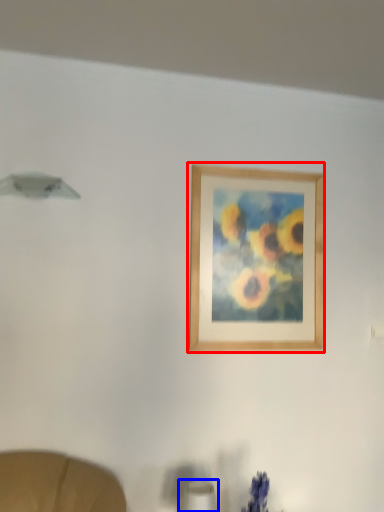
Question: Which point is further to the camera, picture frame (highlighted by a red box) or table lamp (highlighted by a blue box)?

Choices:
 (A) picture frame
 (B) table lamp

Answer: (A)